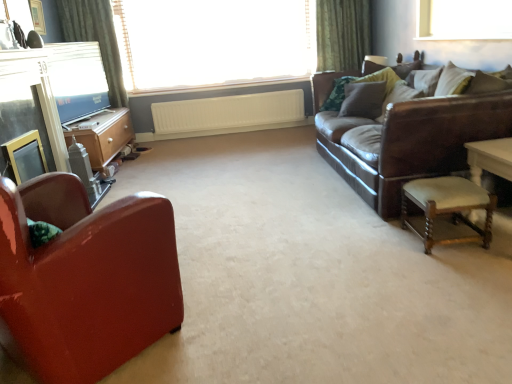
Question: Is white textured curtain at upper center, the first window viewed from the left, at the back of white glass window at upper right, the second window positioned from the back?

Choices:
 (A) no
 (B) yes

Answer: (A)

Question: Are white glass window at upper right, which ranks as the second window in left-to-right order, and white textured curtain at upper center, the 1th window in the back-to-front sequence, located far from each other?

Choices:
 (A) yes
 (B) no

Answer: (A)

Question: Does white glass window at upper right, which ranks as the 1th window in right-to-left order, lie in front of white textured curtain at upper center, the 1th window in the back-to-front sequence?

Choices:
 (A) yes
 (B) no

Answer: (A)

Question: Considering the relative sizes of white glass window at upper right, the second window positioned from the back, and white textured curtain at upper center, the first window viewed from the left, in the image provided, is white glass window at upper right, the second window positioned from the back, smaller than white textured curtain at upper center, the first window viewed from the left,?

Choices:
 (A) yes
 (B) no

Answer: (A)

Question: Does white glass window at upper right, which ranks as the 1th window in right-to-left order, appear on the right side of white textured curtain at upper center, the first window viewed from the left?

Choices:
 (A) no
 (B) yes

Answer: (B)

Question: Considering the relative sizes of white glass window at upper right, which ranks as the second window in left-to-right order, and white textured curtain at upper center, the 1th window in the back-to-front sequence, in the image provided, is white glass window at upper right, which ranks as the second window in left-to-right order, wider than white textured curtain at upper center, the 1th window in the back-to-front sequence,?

Choices:
 (A) no
 (B) yes

Answer: (A)

Question: Is green fabric curtain at upper left facing towards matte black tv at upper left?

Choices:
 (A) yes
 (B) no

Answer: (A)

Question: Considering the relative sizes of green fabric curtain at upper left and matte black tv at upper left in the image provided, is green fabric curtain at upper left thinner than matte black tv at upper left?

Choices:
 (A) yes
 (B) no

Answer: (B)

Question: Does green fabric curtain at upper left contain matte black tv at upper left?

Choices:
 (A) no
 (B) yes

Answer: (A)

Question: Is green fabric curtain at upper left far away from matte black tv at upper left?

Choices:
 (A) no
 (B) yes

Answer: (A)

Question: Is green fabric curtain at upper left positioned before matte black tv at upper left?

Choices:
 (A) no
 (B) yes

Answer: (A)

Question: From the image's perspective, does green fabric curtain at upper left appear lower than matte black tv at upper left?

Choices:
 (A) yes
 (B) no

Answer: (B)

Question: Is velvet brown pillow at upper right, acting as the second pillow starting from the left, far away from leather couch at right?

Choices:
 (A) yes
 (B) no

Answer: (B)